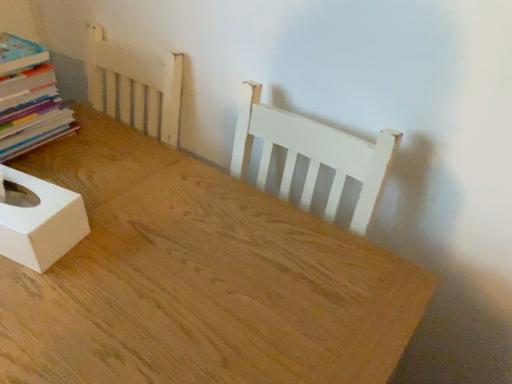
Question: Is natural wood table at center oriented towards multicolored paper stack at left?

Choices:
 (A) yes
 (B) no

Answer: (B)

Question: Does natural wood table at center have a greater width compared to multicolored paper stack at left?

Choices:
 (A) yes
 (B) no

Answer: (A)

Question: Is natural wood table at center shorter than multicolored paper stack at left?

Choices:
 (A) no
 (B) yes

Answer: (A)

Question: Does natural wood table at center have a lesser width compared to multicolored paper stack at left?

Choices:
 (A) no
 (B) yes

Answer: (A)

Question: From the image's perspective, is natural wood table at center beneath multicolored paper stack at left?

Choices:
 (A) yes
 (B) no

Answer: (A)

Question: From the image's perspective, does natural wood table at center appear higher than multicolored paper stack at left?

Choices:
 (A) no
 (B) yes

Answer: (A)

Question: Would you say white matte tissue box at lower left is outside multicolored paper stack at left?

Choices:
 (A) no
 (B) yes

Answer: (B)

Question: From a real-world perspective, is white matte tissue box at lower left physically above multicolored paper stack at left?

Choices:
 (A) yes
 (B) no

Answer: (B)

Question: Is white matte tissue box at lower left further to the viewer compared to multicolored paper stack at left?

Choices:
 (A) no
 (B) yes

Answer: (A)

Question: Is white matte tissue box at lower left thinner than multicolored paper stack at left?

Choices:
 (A) yes
 (B) no

Answer: (A)

Question: Is white matte tissue box at lower left surrounding multicolored paper stack at left?

Choices:
 (A) no
 (B) yes

Answer: (A)

Question: Can you confirm if white matte tissue box at lower left is shorter than multicolored paper stack at left?

Choices:
 (A) no
 (B) yes

Answer: (B)

Question: Is white matte tissue box at lower left closer to camera compared to natural wood table at center?

Choices:
 (A) yes
 (B) no

Answer: (B)